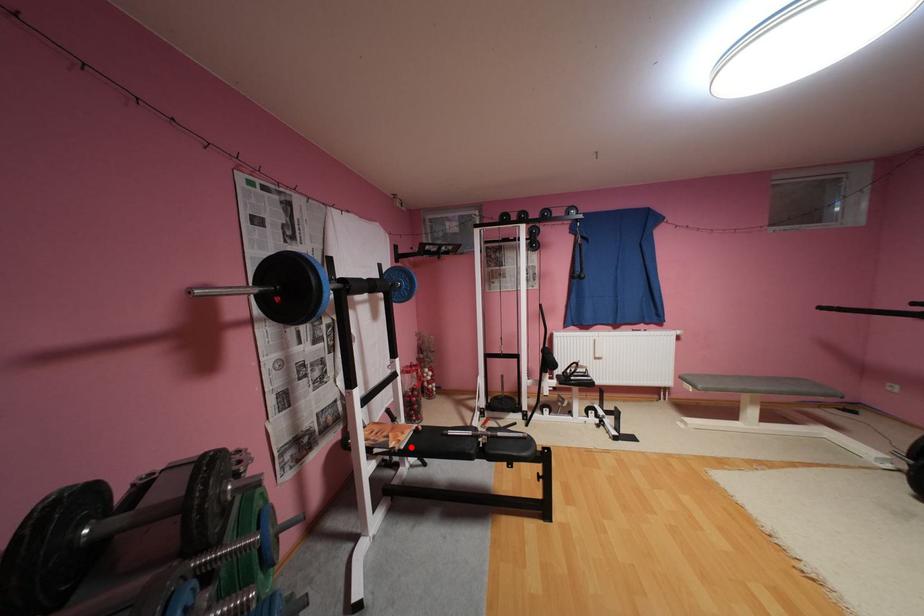
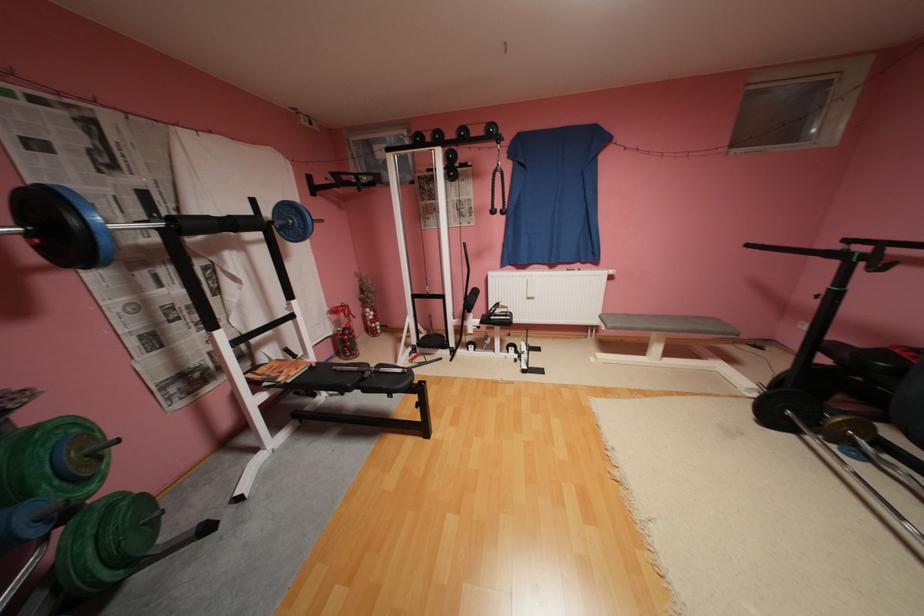
Question: I am providing you with two images of the same scene from different viewpoints. Image1 has a red point marked. In image2, the corresponding 3D location appears at what relative position? Reply with the corresponding letter.

Choices:
 (A) Closer
 (B) Farther

Answer: (B)